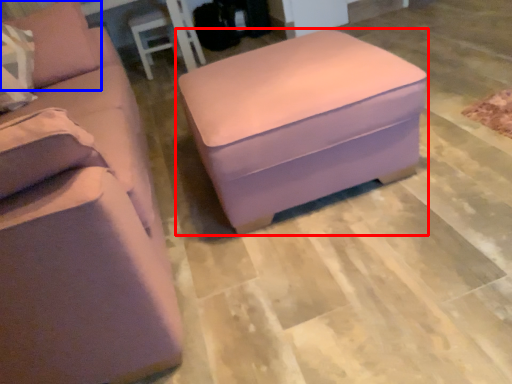
Question: Which point is further to the camera, table (highlighted by a red box) or pillow (highlighted by a blue box)?

Choices:
 (A) table
 (B) pillow

Answer: (B)